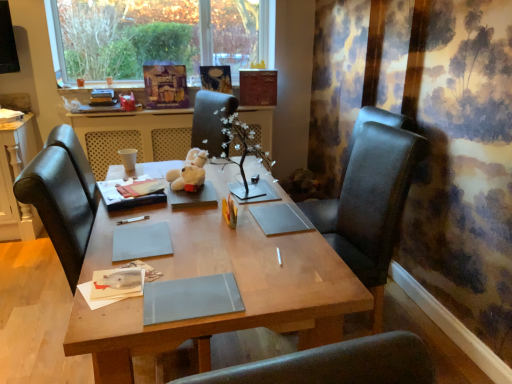
Where is `free point above gray matte notebook at center, which is the 2th notebook from right to left (from a real-world perspective)`? free point above gray matte notebook at center, which is the 2th notebook from right to left (from a real-world perspective) is located at coordinates (137, 235).